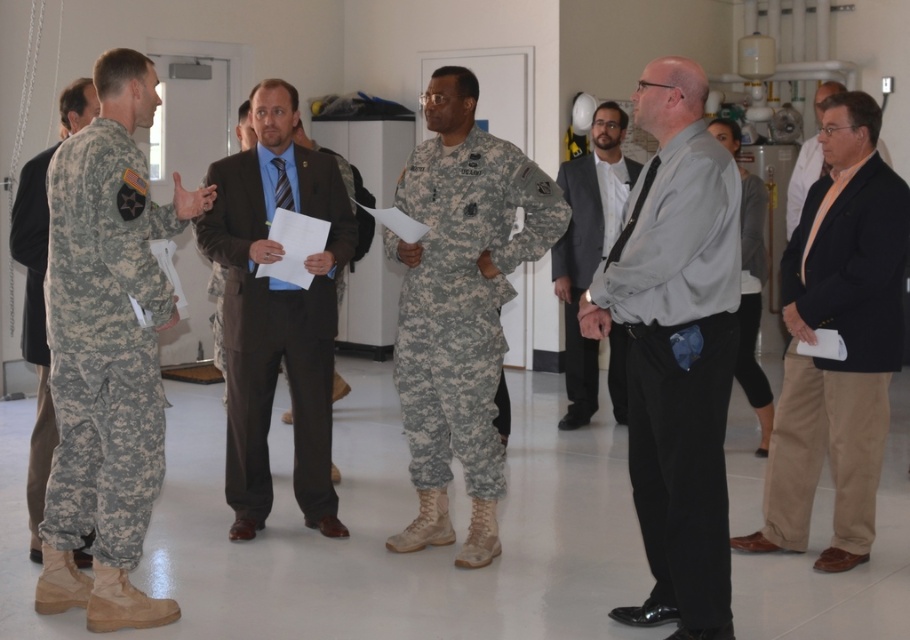
Question: Can you confirm if camouflage fabric uniform at left is positioned to the left of camouflage fabric uniform at center?

Choices:
 (A) no
 (B) yes

Answer: (B)

Question: Observing the image, what is the correct spatial positioning of gray matte shirt at center in reference to white matte shirt at center?

Choices:
 (A) right
 (B) left

Answer: (B)

Question: Which point is farther to the camera?

Choices:
 (A) camouflage fabric uniform at left
 (B) camouflage fabric pants at left
 (C) white matte shirt at center

Answer: (C)

Question: Is gray fabric suit at center further to the viewer compared to camouflage fabric pants at left?

Choices:
 (A) no
 (B) yes

Answer: (B)

Question: Which object is closer to the camera taking this photo?

Choices:
 (A) brown cotton pants at right
 (B) camouflage fabric uniform at center
 (C) gray fabric suit at center
 (D) brown suit at center

Answer: (A)

Question: Which is farther from the gray fabric suit at center?

Choices:
 (A) brown suit at center
 (B) white matte shirt at center
 (C) brown cotton pants at right
 (D) gray matte shirt at center

Answer: (D)